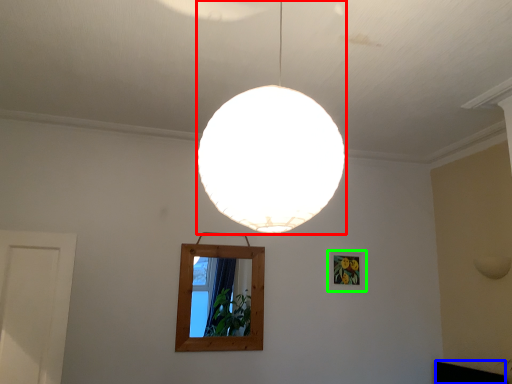
Question: Based on their relative distances, which object is nearer to lamp (highlighted by a red box)? Choose from furniture (highlighted by a blue box) and picture frame (highlighted by a green box).

Choices:
 (A) furniture
 (B) picture frame

Answer: (B)